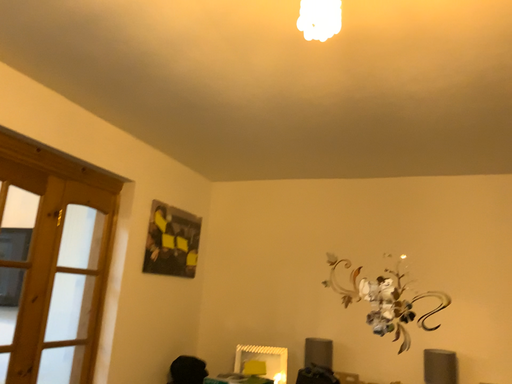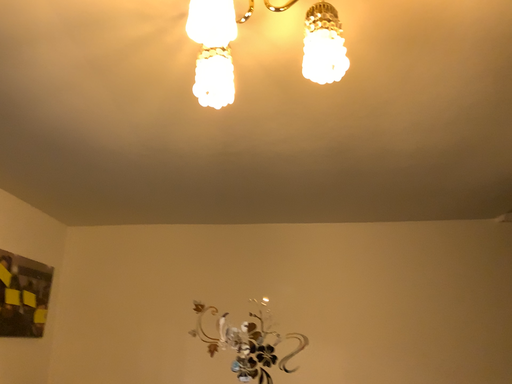
Question: How did the camera likely rotate when shooting the video?

Choices:
 (A) rotated right
 (B) rotated left

Answer: (A)